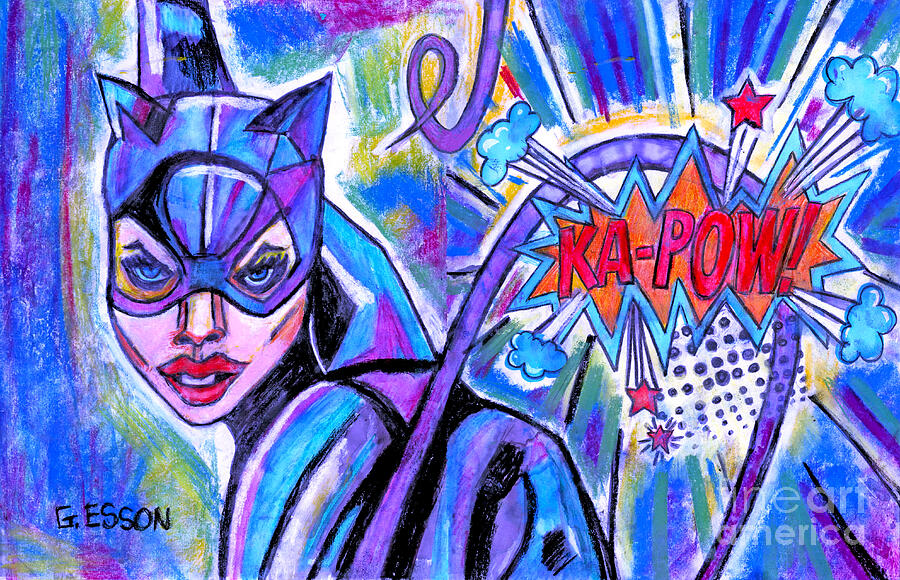
Find the location of a particular element. Image resolution: width=900 pixels, height=580 pixels. mural is located at coordinates (402, 198).